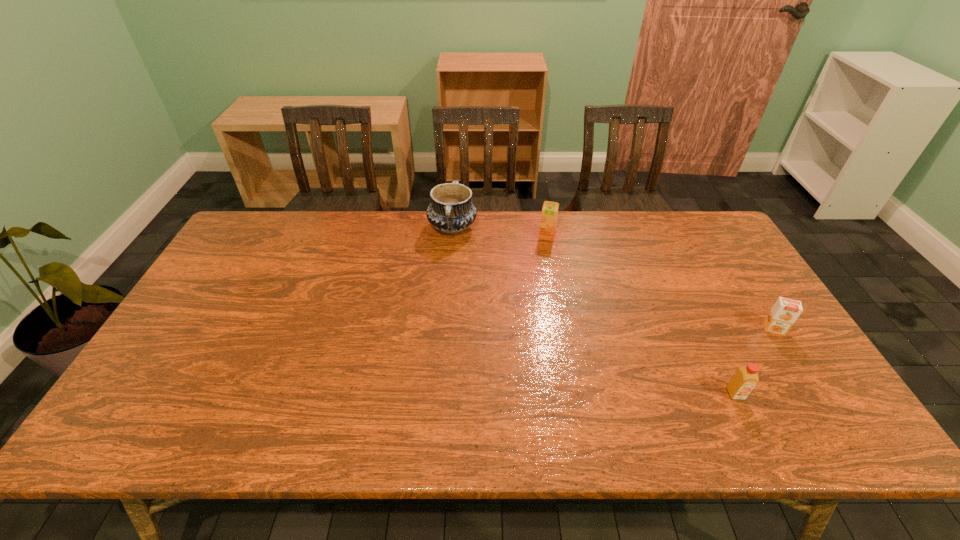
The width and height of the screenshot is (960, 540). In order to click on free point located on the back of the rightmost orange juice in this screenshot , I will do `click(747, 286)`.

Locate an element on the screen. pottery present at the far edge is located at coordinates (451, 211).

Find the location of `orange juice at the far edge`. orange juice at the far edge is located at coordinates (549, 214).

The height and width of the screenshot is (540, 960). I want to click on object at the right edge, so click(x=784, y=313).

In the image, there is a desktop. In order to click on vacant space at the far edge in this screenshot , I will do `click(479, 240)`.

In the image, there is a desktop. Where is `vacant space at the near edge`? The width and height of the screenshot is (960, 540). vacant space at the near edge is located at coordinates (562, 425).

Identify the location of vacant space at the left edge of the desktop. (205, 384).

In the image, there is a desktop. Identify the location of vacant space at the right edge. (810, 381).

Where is `vacant space at the far left corner of the desktop`? vacant space at the far left corner of the desktop is located at coordinates (290, 221).

Identify the location of blank space at the near left corner of the desktop. This screenshot has width=960, height=540. (148, 433).